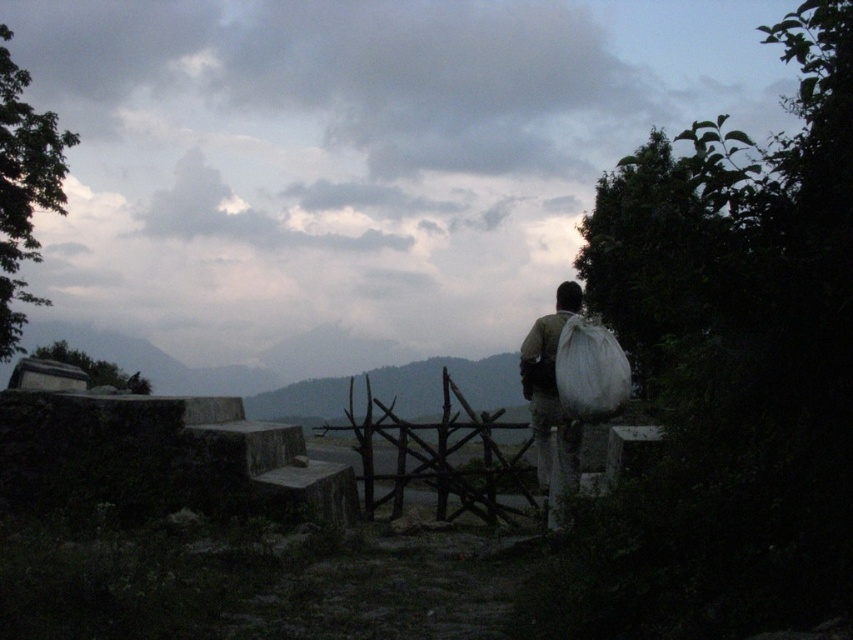
You are a delivery person who needs to hand over the white fabric bag at center to a colleague standing 20 feet away from you. Can you safely throw the bag to your colleague without it going beyond the required distance?

The white fabric bag at center is 18.02 feet away from the camera, so yes, you can safely throw it to your colleague since the distance is within the 20 feet limit.

You are standing at the point marked as point (579, 429) and want to reach the wooden gate. The wooden gate is 25.06 feet away from you. If you can walk 3 feet per second, how many seconds will it take you to reach the wooden gate?

The distance between you and the wooden gate is 25.06 feet. Since you can walk at 3 feet per second, it will take approximately 8.35 seconds to reach the wooden gate.